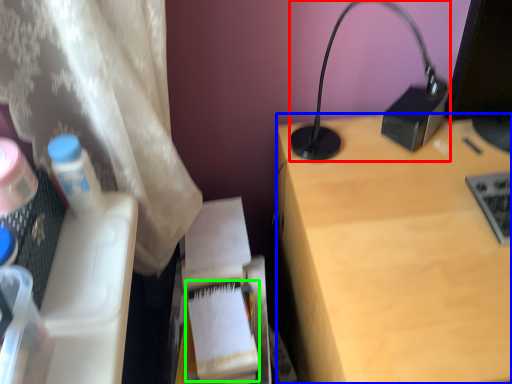
Question: Estimate the real-world distances between objects in this image. Which object is closer to lamp (highlighted by a red box), desk (highlighted by a blue box) or paperback book (highlighted by a green box)?

Choices:
 (A) desk
 (B) paperback book

Answer: (A)